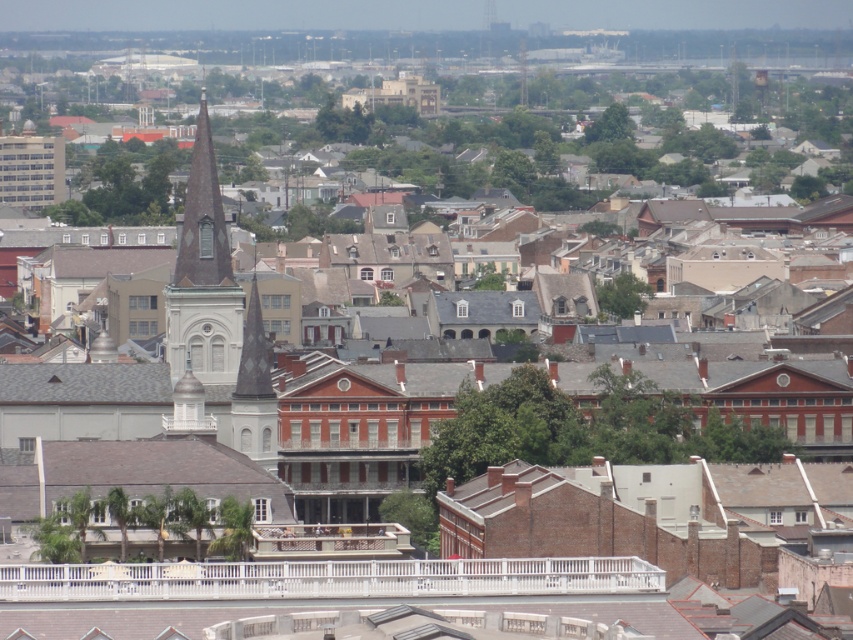
You are standing in the historic district and want to determine which of the two points, point [204,314] or point [258,387], is closer to you. Based on the scene, which point is nearer?

Point [204,314] is closer to you because it is further to the viewer than point [258,387].

You are standing in the historic district and want to take a photo of the smooth gray steeple at center. Given that your camera has a field of view that can capture objects within a 10m radius from your position, and you are currently 15 meters away from the steeple, can you adjust your position to ensure the steeple fits within the camera frame without moving closer than 10 meters?

The smooth gray steeple at center is located at coordinate point (202,276). Since you are 15 meters away and the camera can capture within a 10m radius, you need to move closer. However, moving closer than 10 meters isn not allowed. Therefore, you cannot adjust your position to fit the steeple within the camera frame without violating the minimum distance requirement.